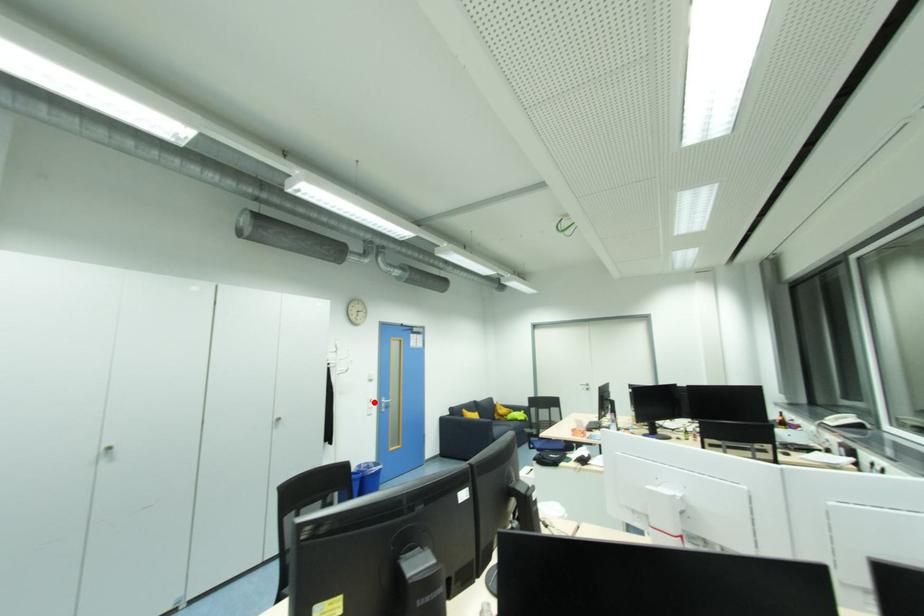
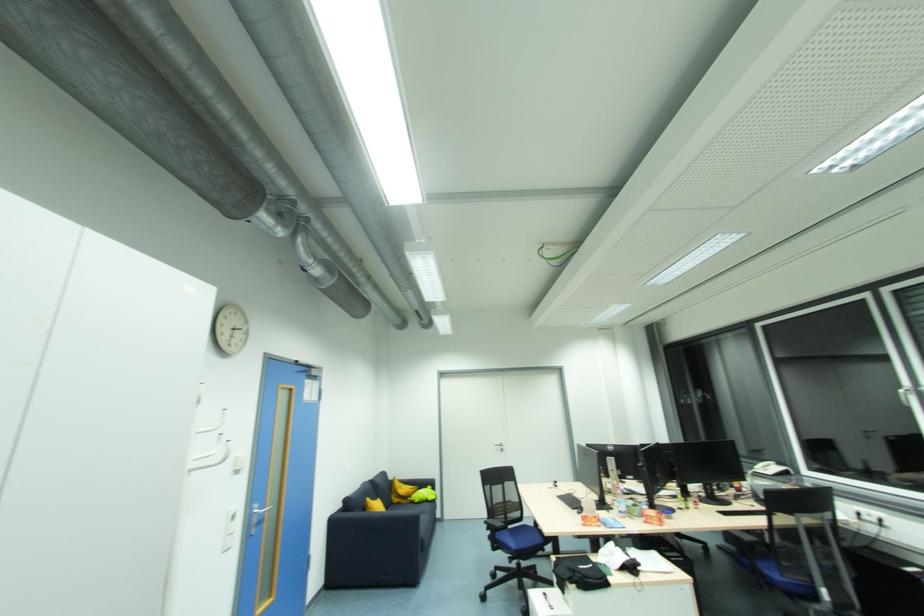
Question: I am providing you with two images of the same scene from different viewpoints. In image1, a red point is highlighted. Considering the same 3D point in image2, which of the following is correct?

Choices:
 (A) It is closer
 (B) It is farther

Answer: (A)